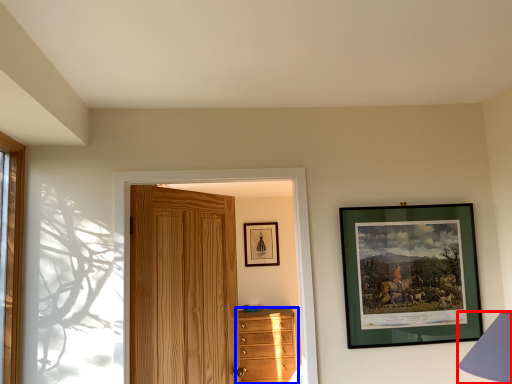
Question: Which object is further to the camera taking this photo, table lamp (highlighted by a red box) or chest of drawers (highlighted by a blue box)?

Choices:
 (A) table lamp
 (B) chest of drawers

Answer: (B)